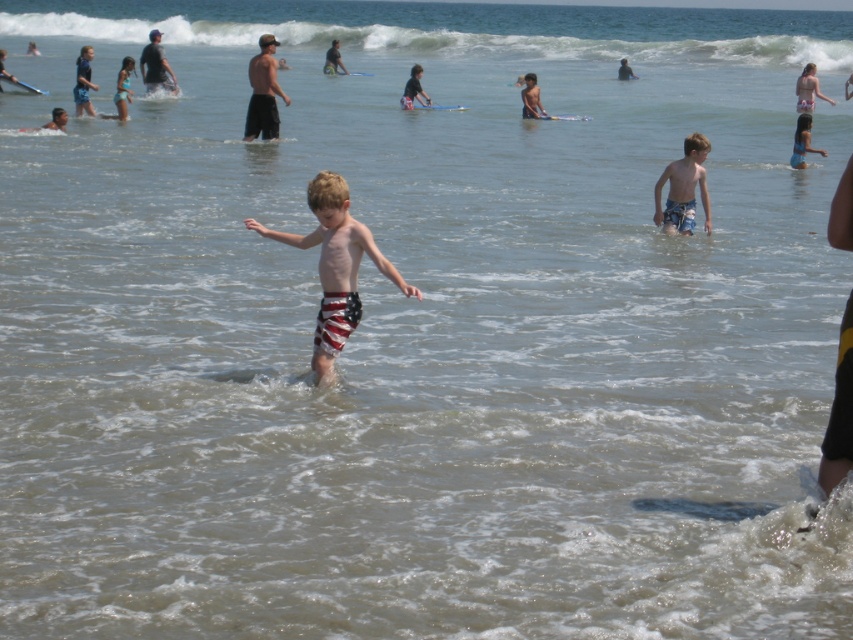
Which of these two, blue striped shorts at center or dark gray fabric shirt at center, stands shorter?

Standing shorter between the two is blue striped shorts at center.

Does blue striped shorts at center appear on the right side of dark gray fabric shirt at center?

Yes, blue striped shorts at center is to the right of dark gray fabric shirt at center.

The image size is (853, 640). What are the coordinates of `blue striped shorts at center` in the screenshot? It's located at (683, 188).

Is point (341, 227) farther from viewer compared to point (86, 104)?

No.

Locate an element on the screen. american flag swim trunks at center is located at coordinates (335, 266).

Is point (325, 216) behind point (78, 81)?

No, (325, 216) is in front of (78, 81).

Where is `american flag swim trunks at center`? Image resolution: width=853 pixels, height=640 pixels. american flag swim trunks at center is located at coordinates (335, 266).

What do you see at coordinates (83, 83) in the screenshot? This screenshot has width=853, height=640. I see `striped swim trunks at center` at bounding box center [83, 83].

Does point (84, 106) lie behind point (334, 72)?

That is False.

In order to click on striped swim trunks at center in this screenshot , I will do `click(83, 83)`.